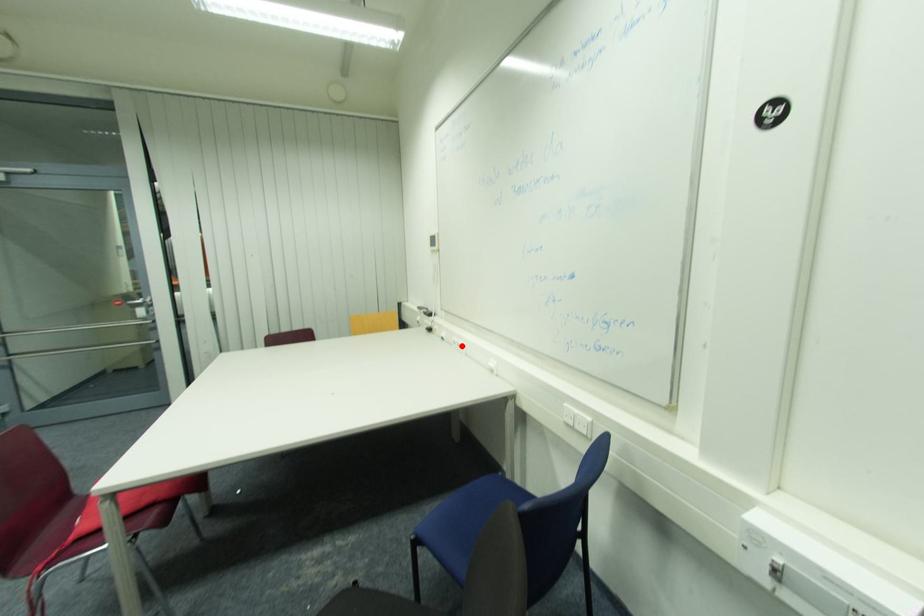
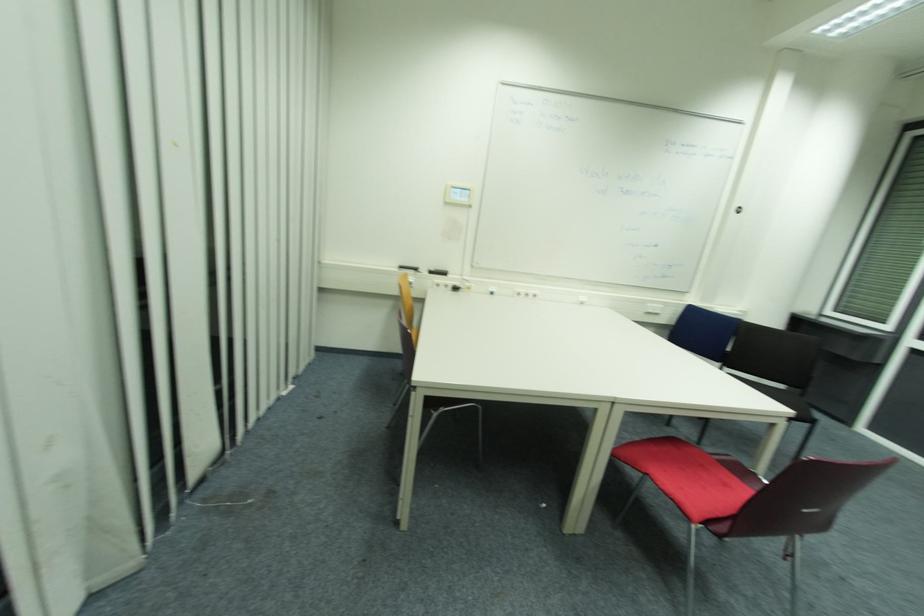
Find the pixel in the second image that matches the highlighted location in the first image.

(529, 294)